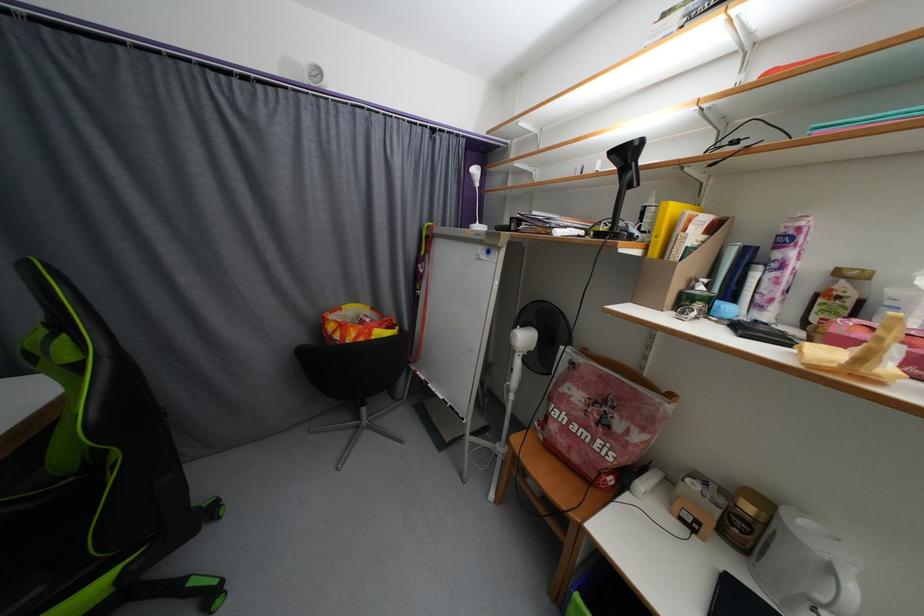
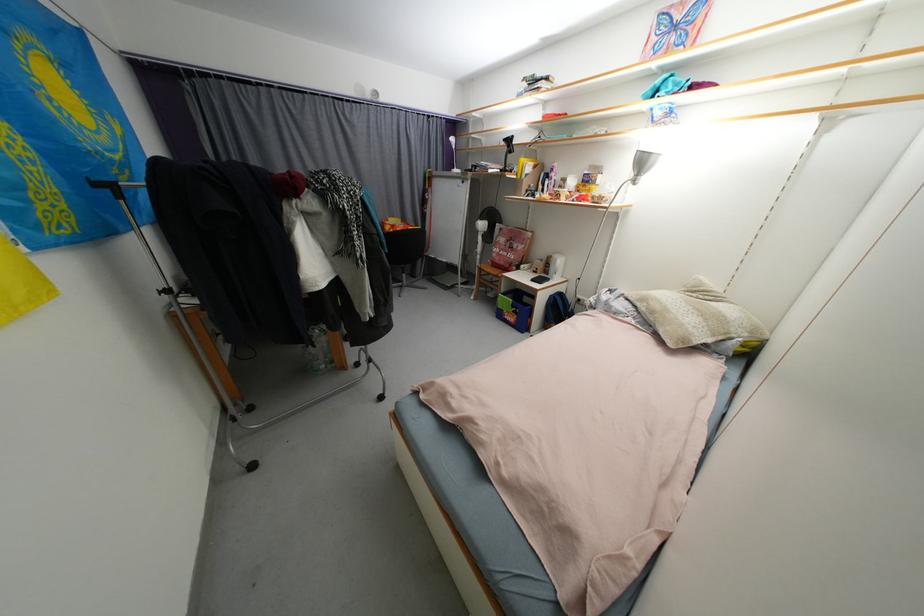
The point at (x=624, y=428) is marked in the first image. Where is the corresponding point in the second image?

(520, 248)